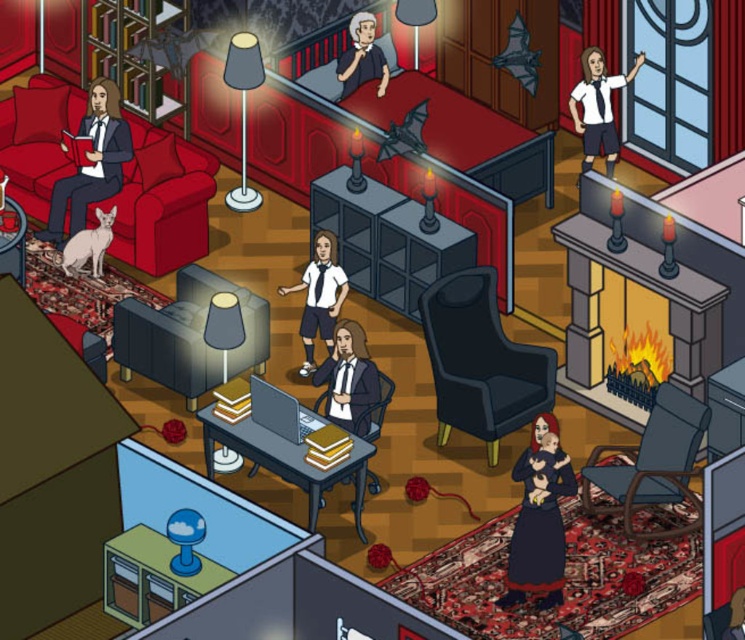
Question: Is matte black couch at left thinner than matte black suit at center?

Choices:
 (A) no
 (B) yes

Answer: (A)

Question: Among these points, which one is farthest from the camera?

Choices:
 (A) (329, 291)
 (B) (524, 502)

Answer: (A)

Question: Among these points, which one is farthest from the camera?

Choices:
 (A) (250, 365)
 (B) (615, 476)

Answer: (A)

Question: Which is nearer to the matte black suit at center?

Choices:
 (A) white glossy shirt at upper right
 (B) matte black chair at center
 (C) matte gray armchair at center

Answer: (B)

Question: Is the position of wooden desk at center more distant than that of white glossy shirt at upper right?

Choices:
 (A) yes
 (B) no

Answer: (B)

Question: Observing the image, what is the correct spatial positioning of matte black chair at center in reference to matte black suit at left?

Choices:
 (A) left
 (B) right

Answer: (B)